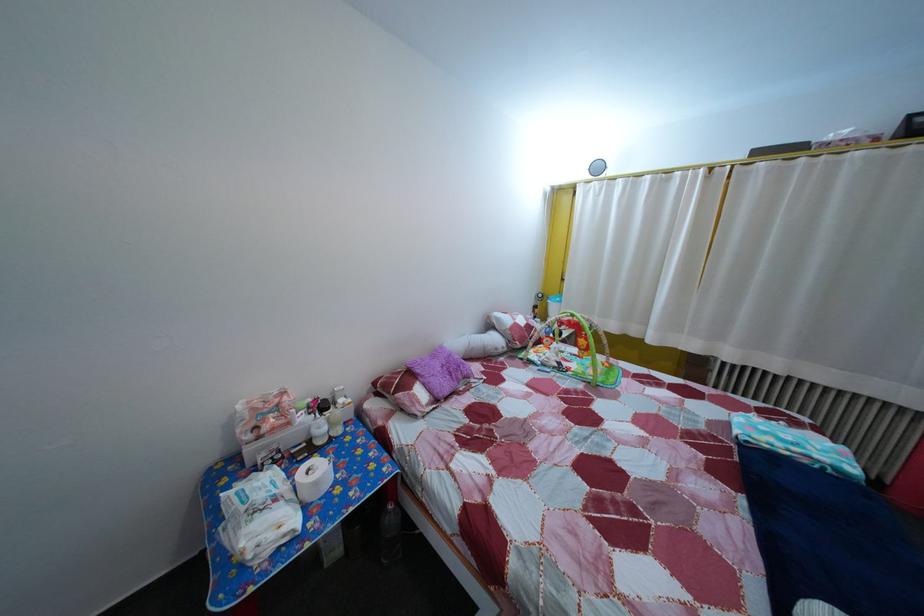
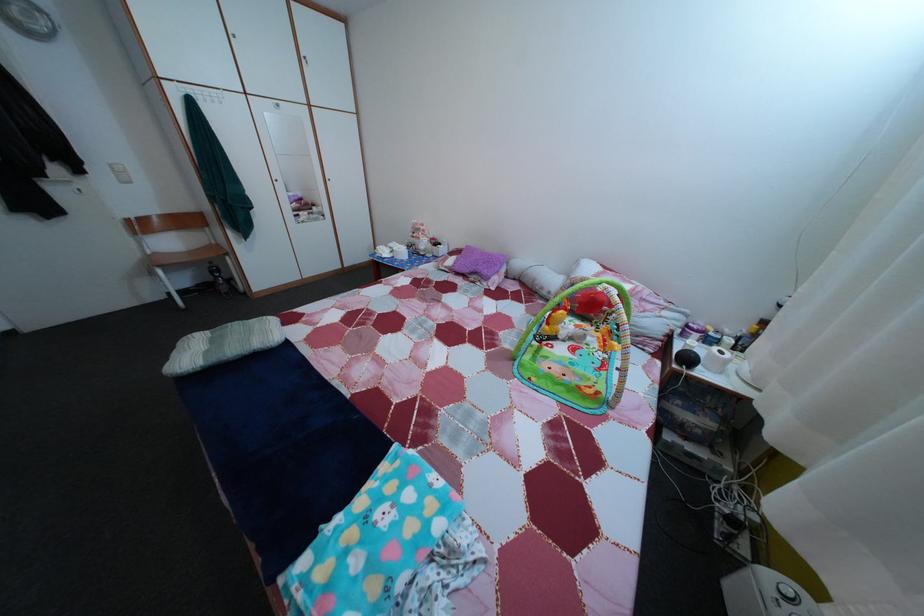
Locate, in the second image, the point that corresponds to the point at 511,359 in the first image.

(553, 301)